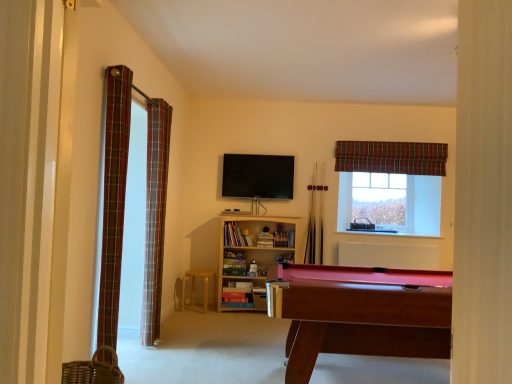
The image size is (512, 384). What do you see at coordinates (258, 176) in the screenshot?
I see `flat screen tv at center` at bounding box center [258, 176].

The image size is (512, 384). In order to click on wooden bookshelf at center in this screenshot , I will do `click(252, 258)`.

Measure the distance between point (106, 146) and camera.

A distance of 2.82 meters exists between point (106, 146) and camera.

This screenshot has height=384, width=512. What do you see at coordinates (312, 220) in the screenshot? I see `wooden pool cue at center, which appears as the 2th cue when viewed from the right` at bounding box center [312, 220].

This screenshot has height=384, width=512. I want to click on clear glass window at upper right, so click(380, 202).

The image size is (512, 384). What do you see at coordinates (380, 202) in the screenshot?
I see `clear glass window at upper right` at bounding box center [380, 202].

Locate an element on the screen. The height and width of the screenshot is (384, 512). wooden pool cue at center, positioned as the first cue in right-to-left order is located at coordinates (321, 218).

Image resolution: width=512 pixels, height=384 pixels. I want to click on flat screen tv at center, so click(258, 176).

Is plaid fabric curtain at upper right, arranged as the third curtain when viewed from the front, taller than wooden pool cue at center, which appears as the 1th cue when viewed from the left?

No.

Based on their positions, is plaid fabric curtain at upper right, placed as the 3th curtain when sorted from left to right, located to the left or right of wooden pool cue at center, which appears as the 2th cue when viewed from the right?

plaid fabric curtain at upper right, placed as the 3th curtain when sorted from left to right, is positioned on wooden pool cue at center, which appears as the 2th cue when viewed from the right,'s right side.

How different are the orientations of plaid fabric curtain at upper right, placed as the 3th curtain when sorted from left to right, and wooden pool cue at center, which appears as the 2th cue when viewed from the right, in degrees?

The angular difference between plaid fabric curtain at upper right, placed as the 3th curtain when sorted from left to right, and wooden pool cue at center, which appears as the 2th cue when viewed from the right, is 0.467 degrees.

Does point (418, 148) come farther from viewer compared to point (313, 231)?

That is True.

Does point (385, 195) lie behind point (192, 276)?

Yes, point (385, 195) is behind point (192, 276).

From the image's perspective, is clear glass window at upper right positioned above or below light brown wooden stool at lower center?

From the image's perspective, clear glass window at upper right appears above light brown wooden stool at lower center.

Does clear glass window at upper right touch light brown wooden stool at lower center?

clear glass window at upper right and light brown wooden stool at lower center are not in contact.

From a real-world perspective, who is located lower, clear glass window at upper right or light brown wooden stool at lower center?

light brown wooden stool at lower center is physically lower.

Is light brown wooden stool at lower center at the back of plaid fabric curtain at upper right, which is counted as the first curtain, starting from the back?

plaid fabric curtain at upper right, which is counted as the first curtain, starting from the back, does not have its back to light brown wooden stool at lower center.

Who is bigger, plaid fabric curtain at upper right, arranged as the third curtain when viewed from the front, or light brown wooden stool at lower center?

Bigger between the two is light brown wooden stool at lower center.

Does plaid fabric curtain at upper right, placed as the 3th curtain when sorted from left to right, have a lesser width compared to light brown wooden stool at lower center?

Correct, the width of plaid fabric curtain at upper right, placed as the 3th curtain when sorted from left to right, is less than that of light brown wooden stool at lower center.

What's the angular difference between plaid fabric curtain at upper right, arranged as the third curtain when viewed from the front, and light brown wooden stool at lower center's facing directions?

The facing directions of plaid fabric curtain at upper right, arranged as the third curtain when viewed from the front, and light brown wooden stool at lower center are 3.08 degrees apart.

Measure the distance between white matte radiator at lower center and flat screen tv at center.

white matte radiator at lower center and flat screen tv at center are 1.50 meters apart from each other.

Which is nearer, [373,264] or [255,175]?

Clearly, point [373,264] is more distant from the camera than point [255,175].

Does white matte radiator at lower center turn towards flat screen tv at center?

No, white matte radiator at lower center is not facing towards flat screen tv at center.

Does white matte radiator at lower center have a lesser width compared to flat screen tv at center?

Incorrect, the width of white matte radiator at lower center is not less than that of flat screen tv at center.

Which is correct: wooden bookshelf at center is inside white matte radiator at lower center, or outside of it?

wooden bookshelf at center is located beyond the bounds of white matte radiator at lower center.

Identify the location of radiator above the wooden bookshelf at center (from the image's perspective). Image resolution: width=512 pixels, height=384 pixels. (388, 255).

Considering the relative sizes of wooden bookshelf at center and white matte radiator at lower center in the image provided, is wooden bookshelf at center bigger than white matte radiator at lower center?

Yes, wooden bookshelf at center is bigger than white matte radiator at lower center.

Can you tell me how much wooden billiard table at lower right and light brown wooden stool at lower center differ in facing direction?

2.1 degrees separate the facing orientations of wooden billiard table at lower right and light brown wooden stool at lower center.

Which is in front, wooden billiard table at lower right or light brown wooden stool at lower center?

wooden billiard table at lower right.

Is wooden billiard table at lower right next to light brown wooden stool at lower center?

wooden billiard table at lower right and light brown wooden stool at lower center are clearly separated.

Does plaid fabric curtain at left, the first curtain when ordered from left to right, have a lesser height compared to wooden pool cue at center, which appears as the 2th cue when viewed from the right?

Incorrect, the height of plaid fabric curtain at left, the first curtain when ordered from left to right, does not fall short of that of wooden pool cue at center, which appears as the 2th cue when viewed from the right.

Would you say plaid fabric curtain at left, positioned as the 3th curtain in right-to-left order, is a long distance from wooden pool cue at center, which appears as the 1th cue when viewed from the left?

Indeed, plaid fabric curtain at left, positioned as the 3th curtain in right-to-left order, is not near wooden pool cue at center, which appears as the 1th cue when viewed from the left.

Is plaid fabric curtain at left, positioned as the 3th curtain in right-to-left order, positioned in front of wooden pool cue at center, which appears as the 2th cue when viewed from the right?

Yes.

In the scene shown: What's the angular difference between plaid fabric curtain at left, the first curtain when ordered from left to right, and wooden pool cue at center, which appears as the 1th cue when viewed from the left,'s facing directions?

There is a 88.6-degree angle between the facing directions of plaid fabric curtain at left, the first curtain when ordered from left to right, and wooden pool cue at center, which appears as the 1th cue when viewed from the left.

From the image's perspective, which curtain is the 3rd one above the wooden pool cue at center, which appears as the 1th cue when viewed from the left? Please provide its 2D coordinates.

[(391, 157)]

Identify the location of stool below the clear glass window at upper right (from a real-world perspective). point(194,288).

Estimate the real-world distances between objects in this image. Which object is further from plaid fabric curtain at left, the 3th curtain viewed from the back, light brown wooden stool at lower center or wooden billiard table at lower right?

Based on the image, light brown wooden stool at lower center appears to be further to plaid fabric curtain at left, the 3th curtain viewed from the back.

Estimate the real-world distances between objects in this image. Which object is further from light brown wooden stool at lower center, white matte radiator at lower center or plaid fabric curtain at left, the second curtain in the left-to-right sequence?

white matte radiator at lower center.

Estimate the real-world distances between objects in this image. Which object is further from wooden billiard table at lower right, wooden pool cue at center, positioned as the first cue in right-to-left order, or light brown wooden stool at lower center?

Among the two, wooden pool cue at center, positioned as the first cue in right-to-left order, is located further to wooden billiard table at lower right.

Based on the photo, which object lies further to the anchor point flat screen tv at center, wooden pool cue at center, positioned as the first cue in right-to-left order, or clear glass window at upper right?

clear glass window at upper right lies further to flat screen tv at center than the other object.

Looking at the image, which one is located further to wooden pool cue at center, which appears as the 1th cue when viewed from the left, wooden pool cue at center, positioned as the first cue in right-to-left order, or flat screen tv at center?

flat screen tv at center is positioned further to the anchor wooden pool cue at center, which appears as the 1th cue when viewed from the left.

Looking at the image, which one is located closer to plaid fabric curtain at upper right, the 1th curtain when ordered from right to left, wooden pool cue at center, which is the second cue in left-to-right order, or flat screen tv at center?

wooden pool cue at center, which is the second cue in left-to-right order, is closer to plaid fabric curtain at upper right, the 1th curtain when ordered from right to left.

Which object lies further to the anchor point wooden pool cue at center, positioned as the first cue in right-to-left order, flat screen tv at center or wooden pool cue at center, which appears as the 2th cue when viewed from the right?

flat screen tv at center is positioned further to the anchor wooden pool cue at center, positioned as the first cue in right-to-left order.

Looking at the image, which one is located closer to clear glass window at upper right, plaid fabric curtain at upper right, the 1th curtain when ordered from right to left, or white matte radiator at lower center?

plaid fabric curtain at upper right, the 1th curtain when ordered from right to left, is positioned closer to the anchor clear glass window at upper right.

You are a GUI agent. You are given a task and a screenshot of the screen. Output one action in this format:
    pyautogui.click(x=<x>, y=<y>)
    Task: Click on the shelf situated between light brown wooden stool at lower center and wooden pool cue at center, which appears as the 1th cue when viewed from the left, from left to right
    The image size is (512, 384).
    Given the screenshot: What is the action you would take?
    pos(252,258)

You are a GUI agent. You are given a task and a screenshot of the screen. Output one action in this format:
    pyautogui.click(x=<x>, y=<y>)
    Task: Click on the stool between plaid fabric curtain at left, the second curtain in the left-to-right sequence, and wooden pool cue at center, which appears as the 1th cue when viewed from the left, from left to right
    This screenshot has width=512, height=384.
    Given the screenshot: What is the action you would take?
    pyautogui.click(x=194, y=288)

You are a GUI agent. You are given a task and a screenshot of the screen. Output one action in this format:
    pyautogui.click(x=<x>, y=<y>)
    Task: Click on the radiator situated between wooden bookshelf at center and clear glass window at upper right from left to right
    The height and width of the screenshot is (384, 512).
    Given the screenshot: What is the action you would take?
    pyautogui.click(x=388, y=255)

Find the location of a particular element. The width and height of the screenshot is (512, 384). stool between wooden billiard table at lower right and wooden pool cue at center, which is the second cue in left-to-right order, from front to back is located at coordinates (194, 288).